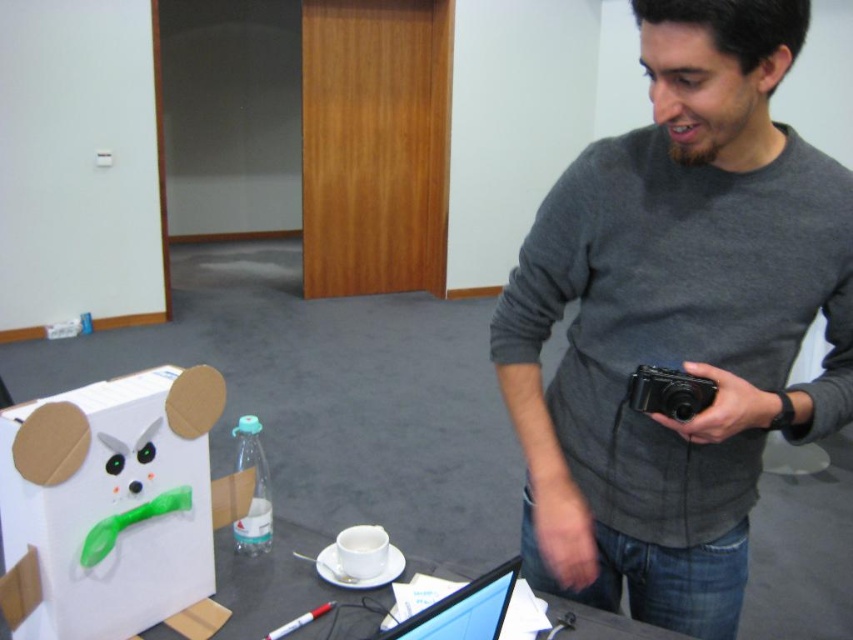
Is gray matte sweater at center behind black plastic camera at center right?

No, gray matte sweater at center is closer to the viewer.

Does gray matte sweater at center have a smaller size compared to black plastic camera at center right?

Actually, gray matte sweater at center might be larger than black plastic camera at center right.

Identify the location of gray matte sweater at center. (677, 321).

Is white cardboard box at lower left above black glossy laptop at center?

Yes, white cardboard box at lower left is above black glossy laptop at center.

Is point (88, 412) farther from camera compared to point (502, 611)?

That is True.

Does point (190, 465) come in front of point (474, 605)?

No, (190, 465) is further to viewer.

Find the location of a particular element. white cardboard box at lower left is located at coordinates (112, 497).

Which is behind, point (166, 380) or point (700, 385)?

The point (166, 380) is behind.

Who is more distant from viewer, (99, 627) or (672, 378)?

The point (99, 627) is behind.

The image size is (853, 640). Identify the location of white cardboard box at lower left. (112, 497).